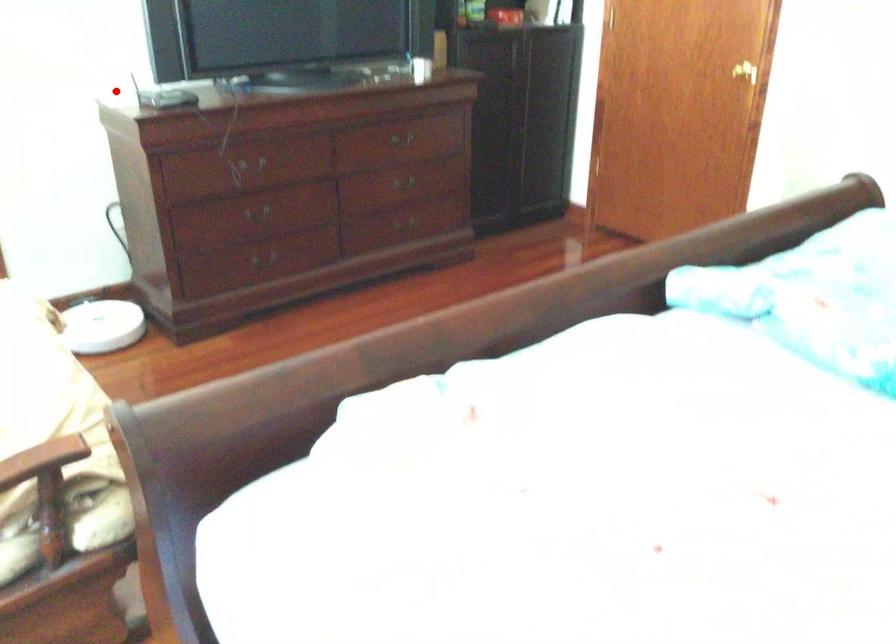
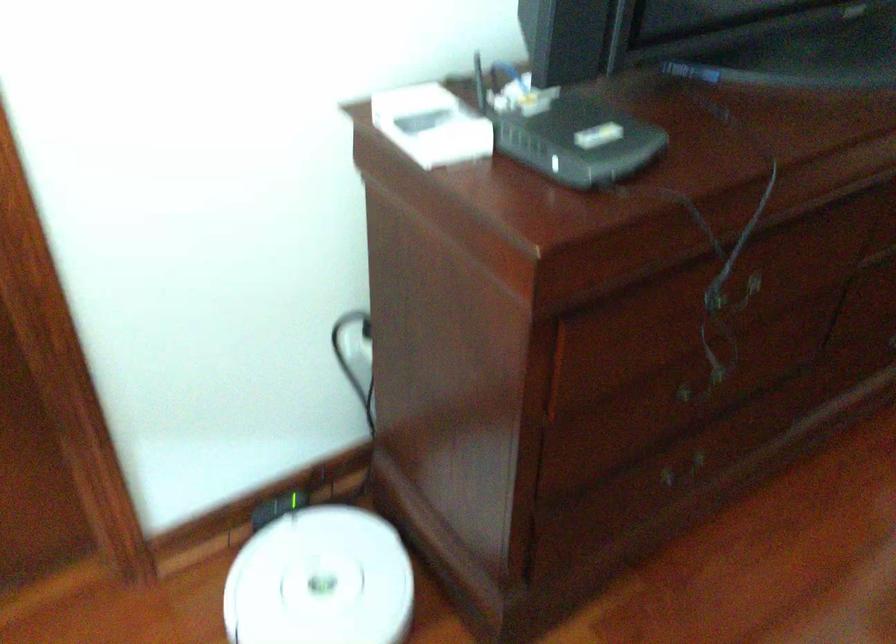
Find the pixel in the second image that matches the highlighted location in the first image.

(431, 125)